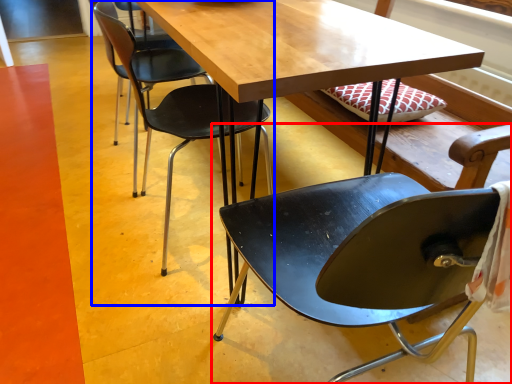
Question: Which point is closer to the camera, chair (highlighted by a red box) or chair (highlighted by a blue box)?

Choices:
 (A) chair
 (B) chair

Answer: (A)